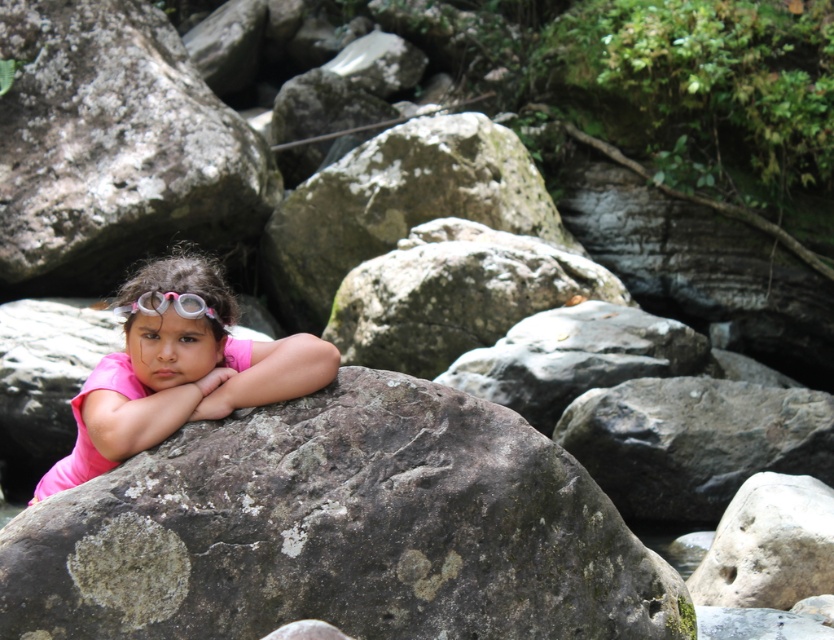
Is point (74, 237) less distant than point (791, 476)?

No.

Is rough gray rock at center further to the viewer compared to smooth gray rock at center?

That is True.

Identify the location of rough gray rock at center. (114, 147).

Looking at this image, who is more forward, [158,177] or [154,353]?

Point [154,353] is more forward.

Can you confirm if rough gray rock at center is positioned to the right of pink matte shirt at center?

Incorrect, rough gray rock at center is not on the right side of pink matte shirt at center.

Measure the distance between point (230, 182) and camera.

A distance of 37.39 feet exists between point (230, 182) and camera.

Where is `rough gray rock at center`? The image size is (834, 640). rough gray rock at center is located at coordinates (114, 147).

Which of these two, speckled rock at center or pink rubber goggles at center, stands shorter?

pink rubber goggles at center

Which is behind, point (235, 579) or point (144, 291)?

Point (144, 291)

Which is behind, point (272, 561) or point (149, 307)?

The point (149, 307) is behind.

The width and height of the screenshot is (834, 640). Identify the location of speckled rock at center. (340, 531).